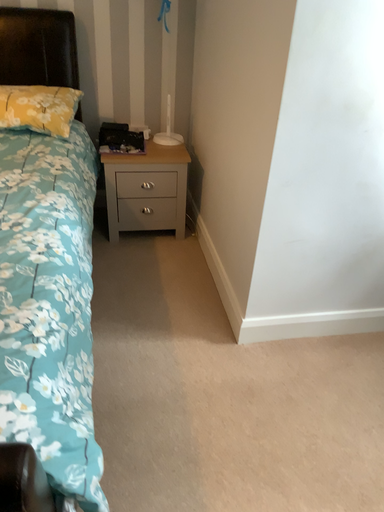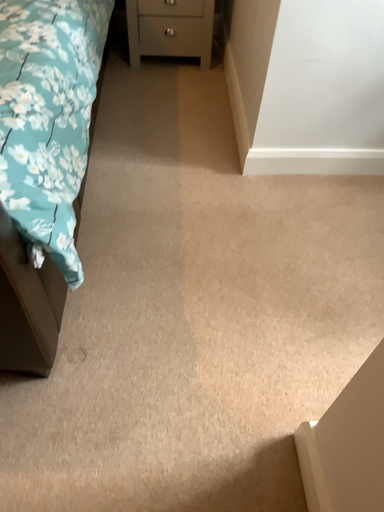
Question: Which way did the camera rotate in the video?

Choices:
 (A) rotated left
 (B) rotated right

Answer: (A)